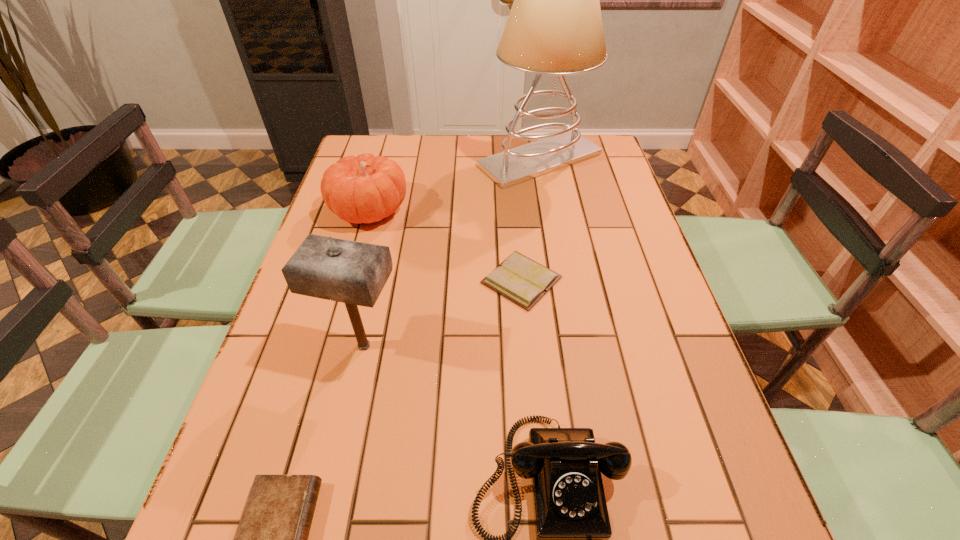
Where is `table lamp`? This screenshot has width=960, height=540. table lamp is located at coordinates (555, 27).

Image resolution: width=960 pixels, height=540 pixels. I want to click on the second tallest object, so click(354, 273).

Where is `mallet`? Image resolution: width=960 pixels, height=540 pixels. mallet is located at coordinates (354, 273).

The width and height of the screenshot is (960, 540). In order to click on pumpkin in this screenshot , I will do `click(364, 189)`.

You are a GUI agent. You are given a task and a screenshot of the screen. Output one action in this format:
    pyautogui.click(x=<x>, y=<y>)
    Task: Click on the right diary
    This screenshot has width=960, height=540.
    Given the screenshot: What is the action you would take?
    pyautogui.click(x=518, y=278)

Locate an element on the screen. The height and width of the screenshot is (540, 960). the third farthest object is located at coordinates pos(518,278).

In order to click on vacant position located 0.200m on the front of the tallest object in this screenshot , I will do `click(552, 231)`.

Locate an element on the screen. free space located on the front of the third nearest object is located at coordinates (331, 494).

Where is `vacant space located 0.160m on the back of the third tallest object`? The width and height of the screenshot is (960, 540). vacant space located 0.160m on the back of the third tallest object is located at coordinates (384, 160).

Locate an element on the screen. This screenshot has width=960, height=540. free space located 0.240m on the back of the farther diary is located at coordinates [514, 198].